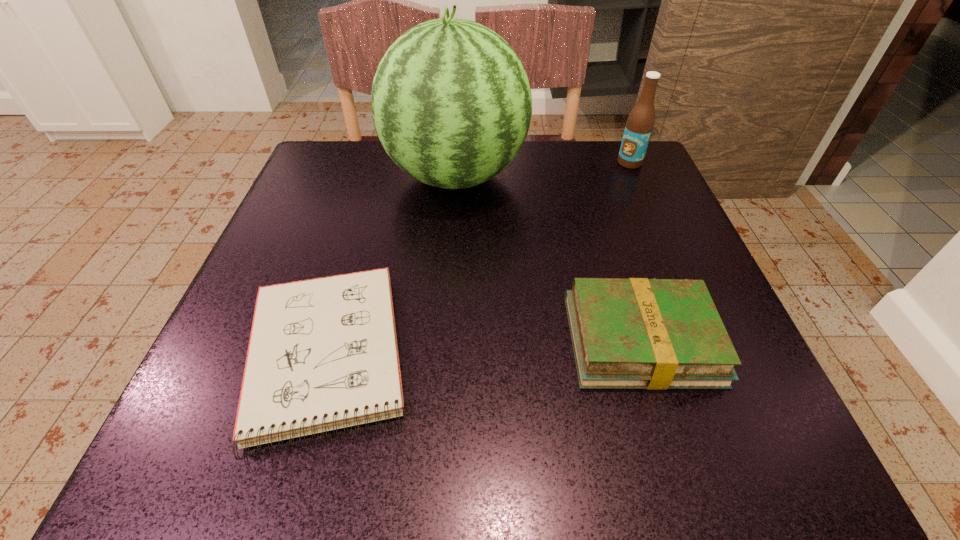
Find the location of `object located at the near edge`. object located at the near edge is located at coordinates (323, 354).

Image resolution: width=960 pixels, height=540 pixels. Find the location of `object present at the left edge`. object present at the left edge is located at coordinates (323, 354).

The height and width of the screenshot is (540, 960). In order to click on beer bottle at the right edge in this screenshot , I will do `click(640, 122)`.

Where is `book at the right edge`? This screenshot has width=960, height=540. book at the right edge is located at coordinates (637, 333).

Where is `object that is at the near left corner`? object that is at the near left corner is located at coordinates (323, 354).

Locate an element on the screen. object present at the far right corner is located at coordinates (640, 122).

In the image, there is a desktop. Identify the location of vacant area at the far edge. The image size is (960, 540). (552, 182).

What are the coordinates of `free region at the near edge` in the screenshot? It's located at (359, 442).

Image resolution: width=960 pixels, height=540 pixels. Identify the location of blank area at the left edge. (281, 246).

Where is `blank space at the right edge`? This screenshot has height=540, width=960. blank space at the right edge is located at coordinates (663, 211).